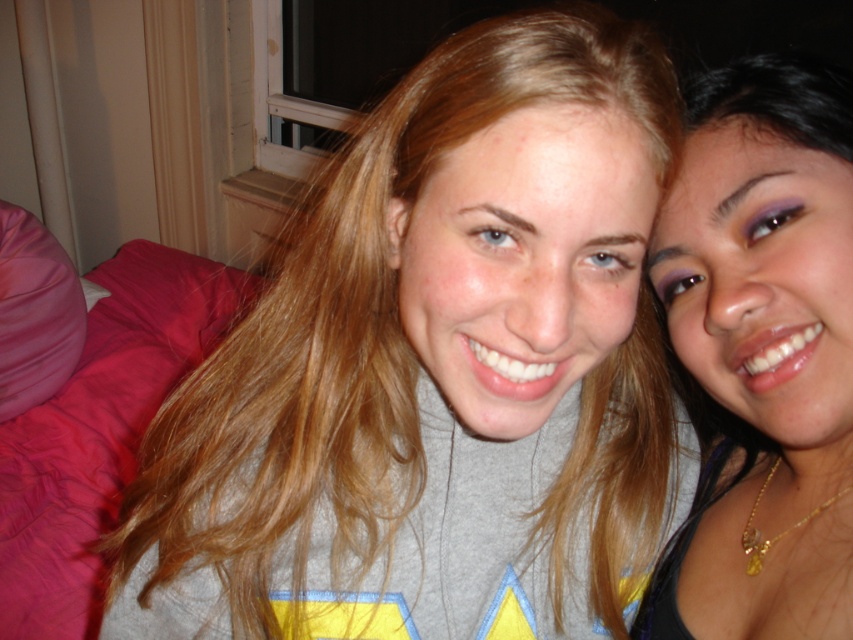
Question: Which point appears farthest from the camera in this image?

Choices:
 (A) (784, 477)
 (B) (573, 492)

Answer: (A)

Question: Does gray matte sweatshirt at center appear under matte gold necklace at right?

Choices:
 (A) no
 (B) yes

Answer: (B)

Question: Is gray matte sweatshirt at center smaller than matte gold necklace at right?

Choices:
 (A) no
 (B) yes

Answer: (A)

Question: Does gray matte sweatshirt at center lie in front of matte gold necklace at right?

Choices:
 (A) yes
 (B) no

Answer: (A)